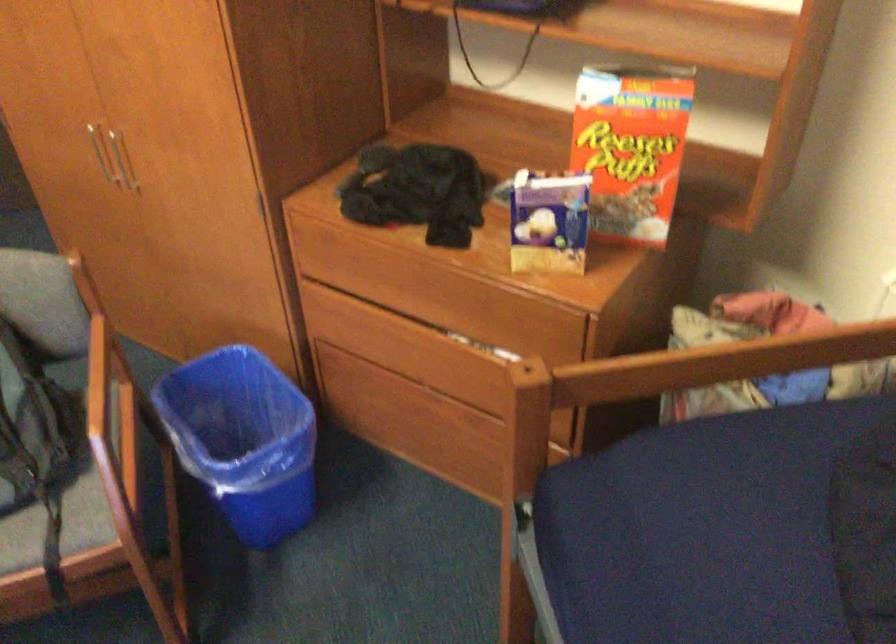
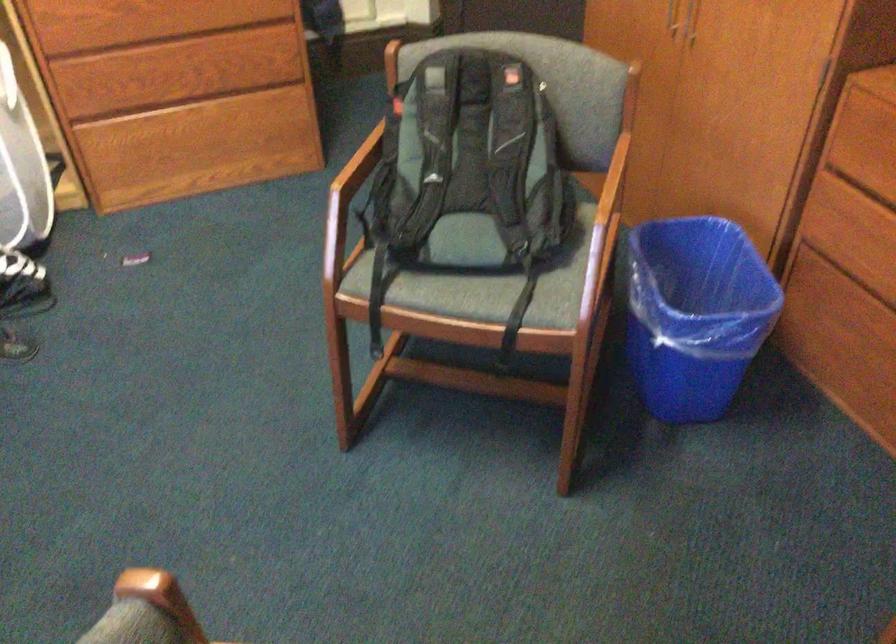
Where in the second image is the point corresponding to point 105,404 from the first image?

(609, 201)